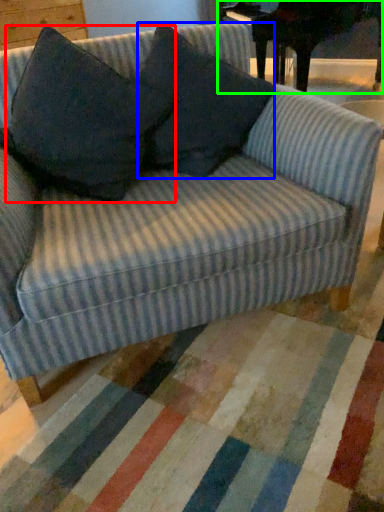
Question: Considering the real-world distances, which object is closest to throw pillow (highlighted by a red box)? throw pillow (highlighted by a blue box) or table (highlighted by a green box).

Choices:
 (A) throw pillow
 (B) table

Answer: (A)